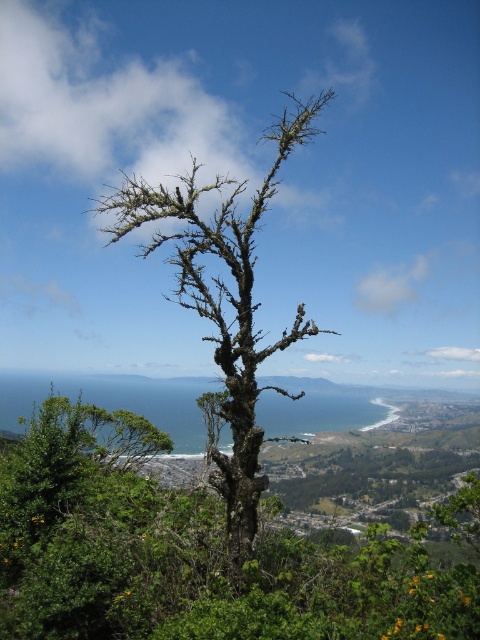
Does green mossy tree at center have a smaller size compared to dark brown bark tree at center?

Yes.

From the picture: Does green mossy tree at center appear on the left side of dark brown bark tree at center?

Incorrect, green mossy tree at center is not on the left side of dark brown bark tree at center.

Image resolution: width=480 pixels, height=640 pixels. Identify the location of green mossy tree at center. (192, 557).